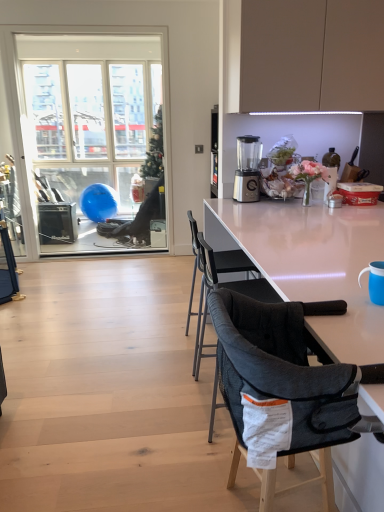
The height and width of the screenshot is (512, 384). I want to click on empty space that is in between sleek silver blender at center and blue plastic cup at right, so click(x=281, y=229).